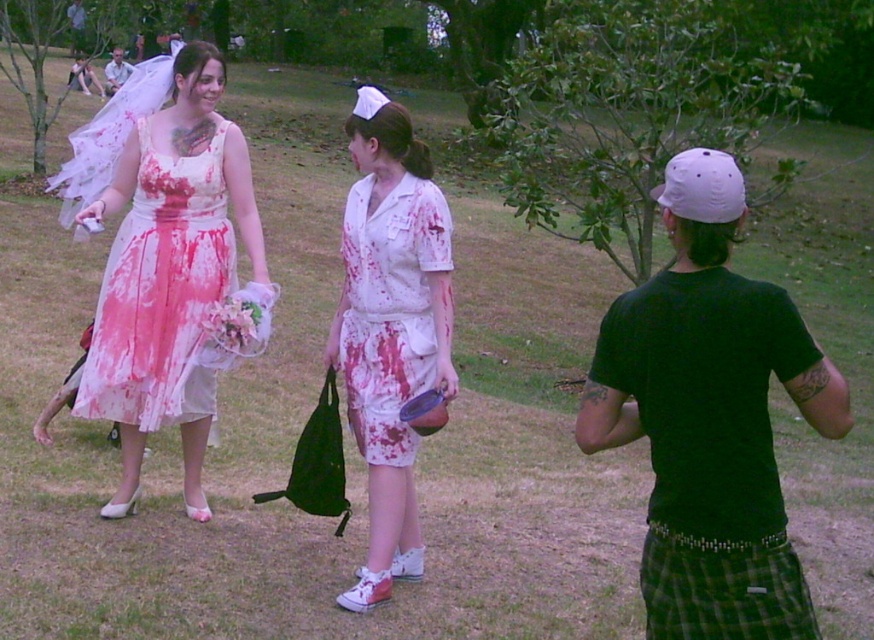
Between point (87, 384) and point (119, 83), which one is positioned in front?

Positioned in front is point (87, 384).

Is white satin dress at left to the left of matte black shirt at center from the viewer's perspective?

In fact, white satin dress at left is to the right of matte black shirt at center.

At what (x,y) coordinates should I click in order to perform the action: click on white satin dress at left. Please return your answer as a coordinate pair (x, y). Looking at the image, I should click on (162, 294).

I want to click on white satin dress at left, so click(x=162, y=294).

Which is behind, point (663, 520) or point (427, 236)?

Point (427, 236)

Is black cotton t-shirt at right thinner than white cotton nurse uniform at center?

No, black cotton t-shirt at right is not thinner than white cotton nurse uniform at center.

The image size is (874, 640). I want to click on black cotton t-shirt at right, so click(711, 419).

Does black cotton t-shirt at right appear on the right side of blood-stained fabric dress at center?

Correct, you'll find black cotton t-shirt at right to the right of blood-stained fabric dress at center.

I want to click on black cotton t-shirt at right, so click(711, 419).

Locate an element on the screen. black cotton t-shirt at right is located at coordinates (711, 419).